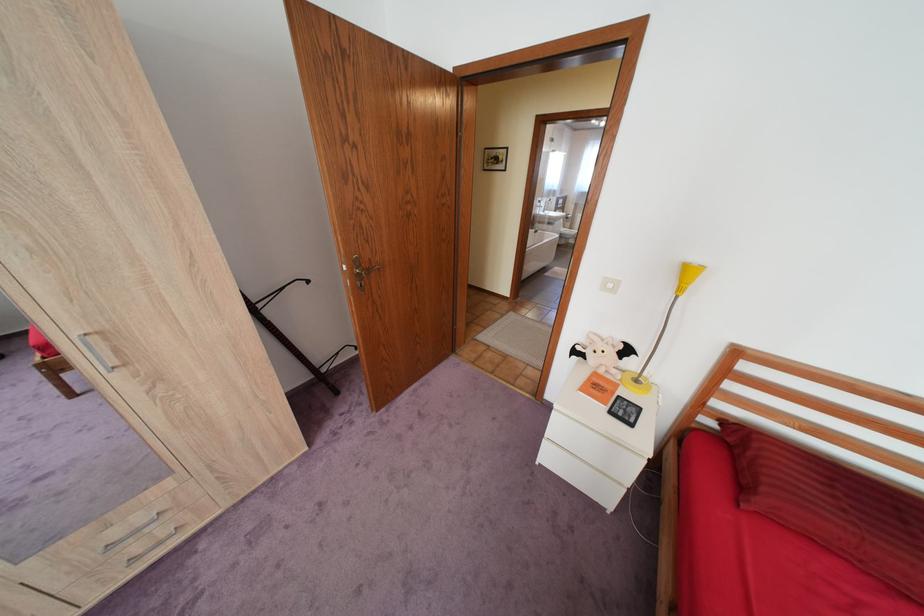
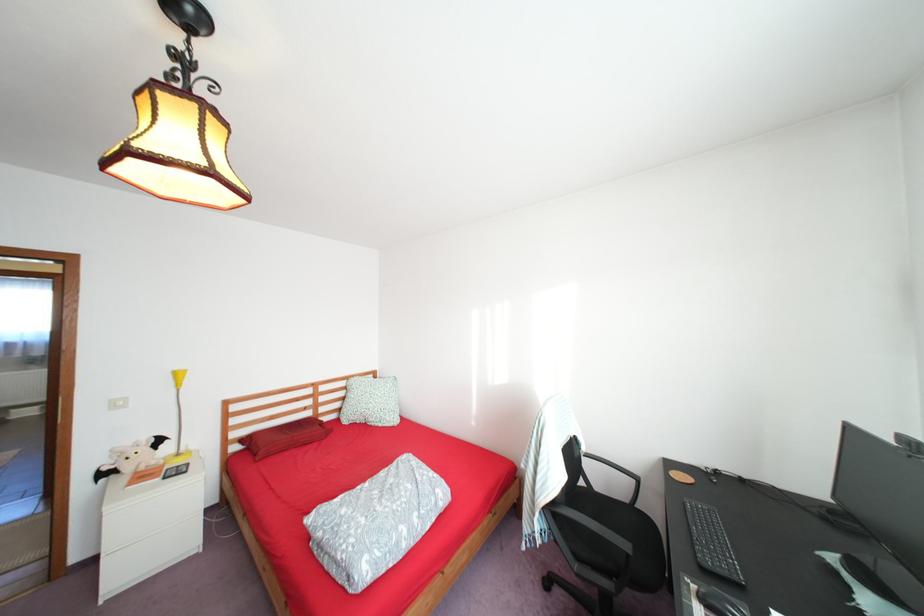
In the second image, find the point that corresponds to [590,347] in the first image.

(116, 468)